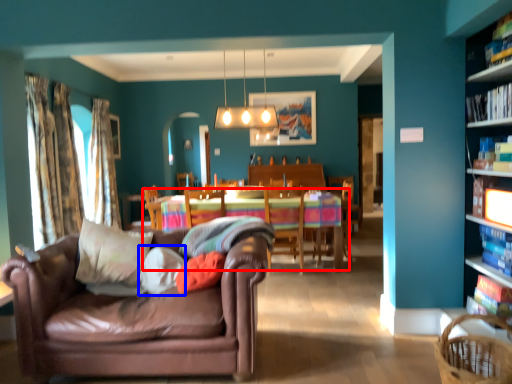
Question: Among these objects, which one is farthest to the camera, kitchen & dining room table (highlighted by a red box) or pillow (highlighted by a blue box)?

Choices:
 (A) kitchen & dining room table
 (B) pillow

Answer: (A)